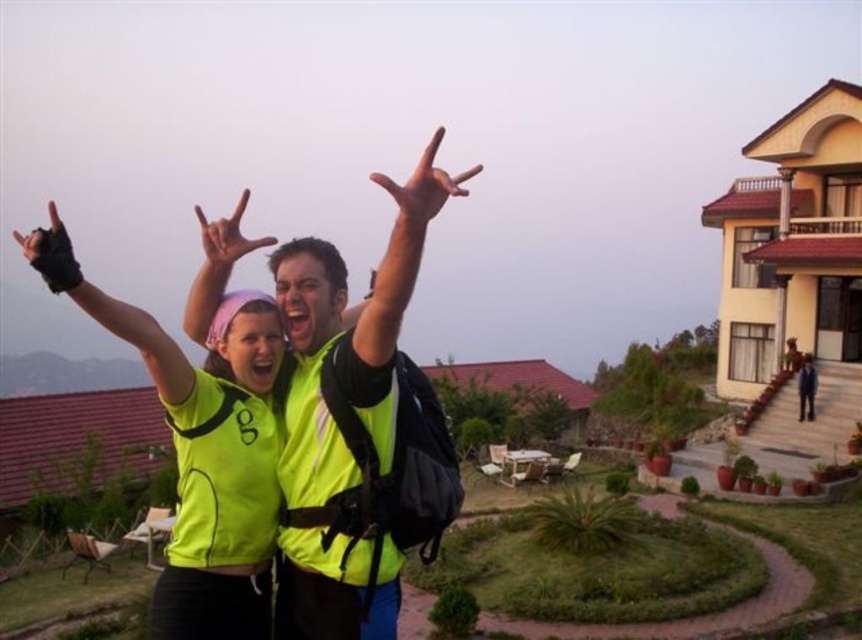
In the scene shown: You are a photographer standing at the camera position. You want to take a closeup shot of the neon yellow reflective vest at center. Can you walk closer to it without leaving the residential area shown in the scene?

The neon yellow reflective vest at center is 4.04 meters away from the camera. Since the photographer can walk closer within the residential area shown, they can approach the vest to get a better closeup shot.

You are standing at the point with coordinates point (223, 262) and want to walk to the point with coordinates point (423, 214). Which direction should you move relative to your current position?

You should move backward because point (423, 214) is behind point (223, 262) from your perspective.

You are designing a poster and need to place the green matte vest at upper center and the green matte hand at center. Given their sizes, which object should be placed closer to the viewer to maintain visual balance?

The green matte vest at upper center has a lesser width compared to the green matte hand at center. To maintain visual balance, the smaller vest should be placed closer to the viewer while the larger hand is positioned further back.